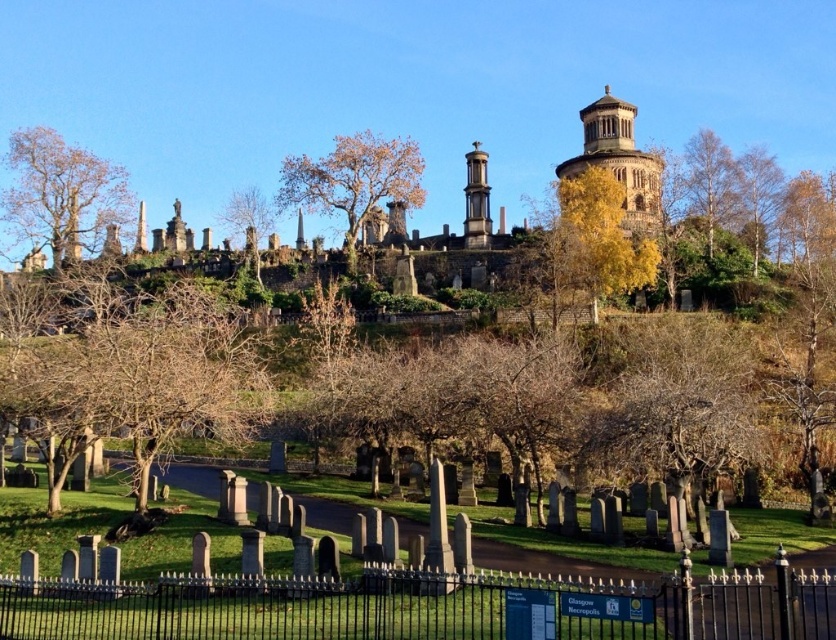
Does black wrought iron fence at lower center have a greater width compared to smooth stone tower at center?

Indeed, black wrought iron fence at lower center has a greater width compared to smooth stone tower at center.

Is black wrought iron fence at lower center to the right of smooth stone tower at center from the viewer's perspective?

Incorrect, black wrought iron fence at lower center is not on the right side of smooth stone tower at center.

Locate an element on the screen. The image size is (836, 640). black wrought iron fence at lower center is located at coordinates (426, 605).

Who is positioned more to the left, bare wood tree at center or smooth stone tower at center?

bare wood tree at center

Is bare wood tree at center positioned behind smooth stone tower at center?

No, it is in front of smooth stone tower at center.

Find the location of `bare wood tree at center`. bare wood tree at center is located at coordinates (134, 376).

Find the location of a particular element. Image resolution: width=836 pixels, height=640 pixels. bare wood tree at center is located at coordinates (134, 376).

Does brown leafy tree at center appear under smooth stone tower at center?

No.

What do you see at coordinates (353, 180) in the screenshot?
I see `brown leafy tree at center` at bounding box center [353, 180].

This screenshot has height=640, width=836. Identify the location of brown leafy tree at center. (353, 180).